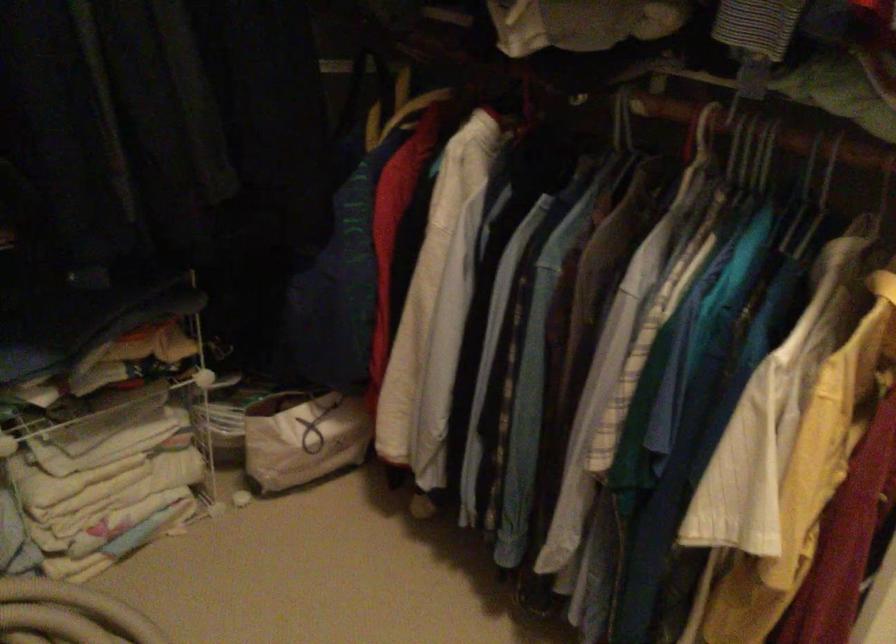
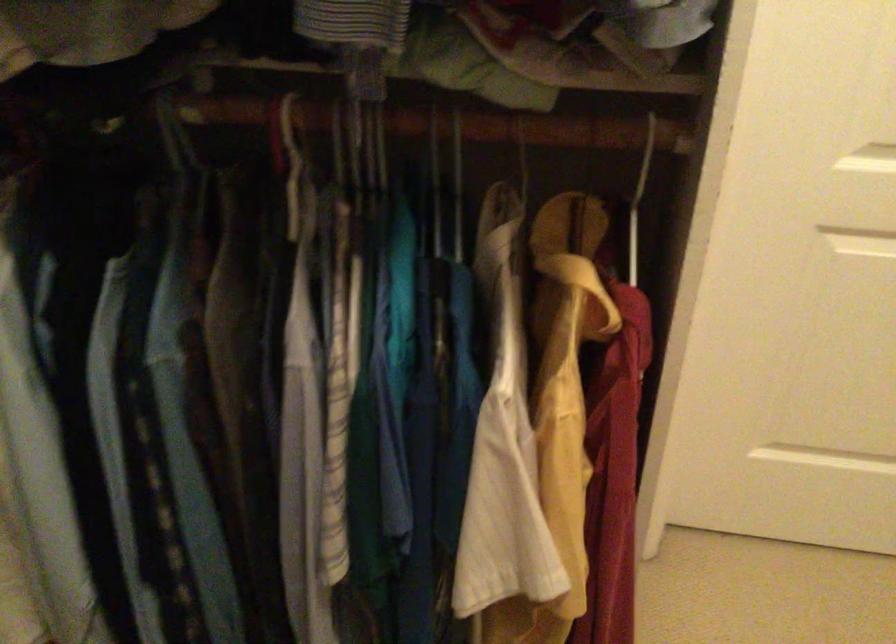
Question: The images are taken continuously from a first-person perspective. In which direction is your viewpoint rotating?

Choices:
 (A) Left
 (B) Right
 (C) Up
 (D) Down

Answer: (B)